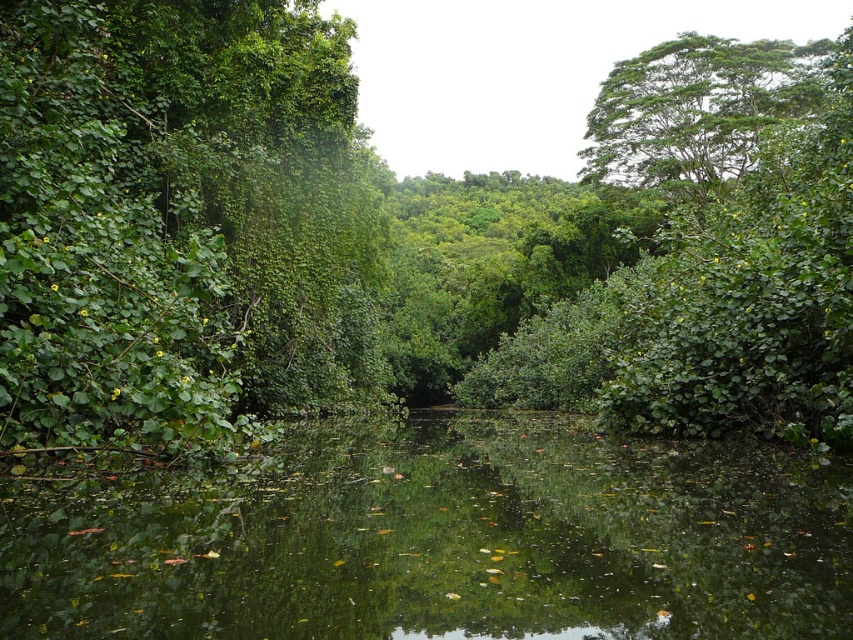
Can you confirm if green leafy tree at left is thinner than green leafy water at center?

Yes, green leafy tree at left is thinner than green leafy water at center.

Is point (61, 28) in front of point (822, 632)?

No.

This screenshot has width=853, height=640. I want to click on green leafy tree at left, so [x=181, y=228].

Can you confirm if green leafy water at center is thinner than green leafy tree at upper right?

Correct, green leafy water at center's width is less than green leafy tree at upper right's.

Does point (262, 568) lie behind point (630, 186)?

No, it is in front of (630, 186).

Between point (514, 612) and point (711, 104), which one is positioned in front?

Point (514, 612)

I want to click on green leafy water at center, so click(x=456, y=541).

Does green leafy tree at left have a greater width compared to green leafy tree at upper right?

No, green leafy tree at left is not wider than green leafy tree at upper right.

Is point (173, 193) closer to viewer compared to point (776, 90)?

Yes, point (173, 193) is closer to viewer.

Locate an element on the screen. The width and height of the screenshot is (853, 640). green leafy tree at left is located at coordinates (181, 228).